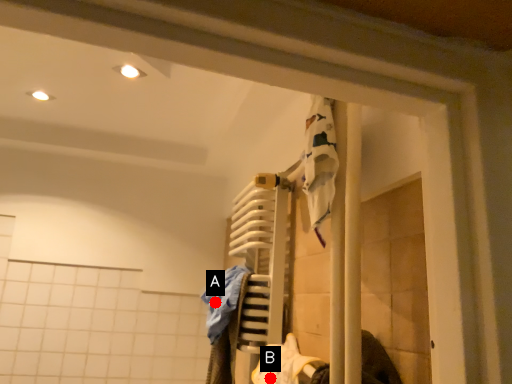
Question: Two points are circled on the image, labeled by A and B beside each circle. Which point is further to the camera?

Choices:
 (A) A is further
 (B) B is further

Answer: (A)